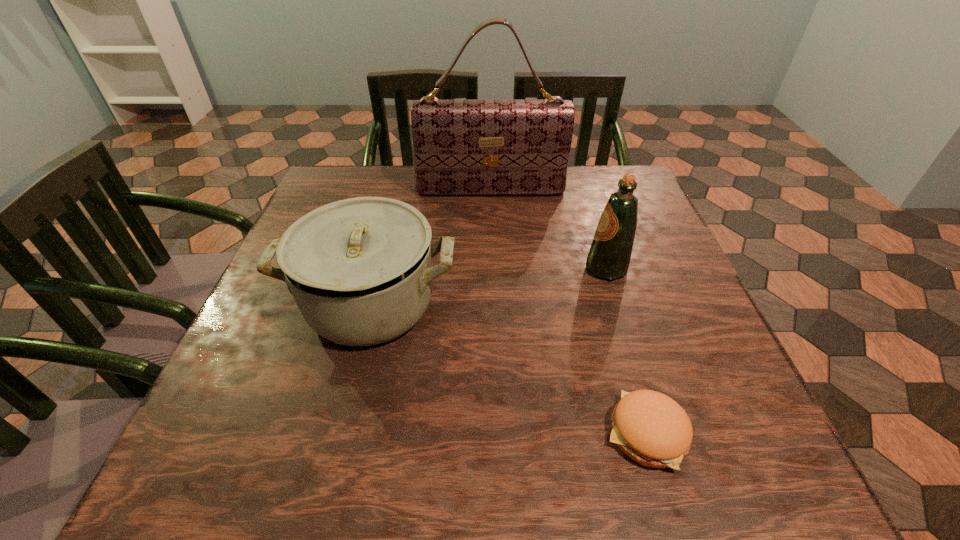
The image size is (960, 540). Find the location of `unoccupied area between the olive oil and the tallest object`. unoccupied area between the olive oil and the tallest object is located at coordinates (548, 230).

The height and width of the screenshot is (540, 960). Identify the location of free point between the nearest object and the third shortest object. (626, 350).

Point out which object is positioned as the second nearest to the olive oil. Please provide its 2D coordinates. Your answer should be formatted as a tuple, i.e. [(x, y)], where the tuple contains the x and y coordinates of a point satisfying the conditions above.

[(651, 428)]

Identify which object is located as the third nearest to the nearest object. Please provide its 2D coordinates. Your answer should be formatted as a tuple, i.e. [(x, y)], where the tuple contains the x and y coordinates of a point satisfying the conditions above.

[(460, 147)]

In order to click on free location that satisfies the following two spatial constraints: 1. on the front side of the shortest object; 2. on the right side of the second shortest object in this screenshot , I will do `click(339, 433)`.

At what (x,y) coordinates should I click in order to perform the action: click on free location that satisfies the following two spatial constraints: 1. on the front of the nearest object with the clasp; 2. on the right side of the farthest object. Please return your answer as a coordinate pair (x, y). The image size is (960, 540). Looking at the image, I should click on (497, 433).

Find the location of a particular element. The height and width of the screenshot is (540, 960). free location that satisfies the following two spatial constraints: 1. on the front-facing side of the third shortest object; 2. on the front side of the patty is located at coordinates (658, 433).

Find the location of a particular element. The image size is (960, 540). free point that satisfies the following two spatial constraints: 1. on the front of the handbag with the clasp; 2. on the right side of the shortest object is located at coordinates (497, 433).